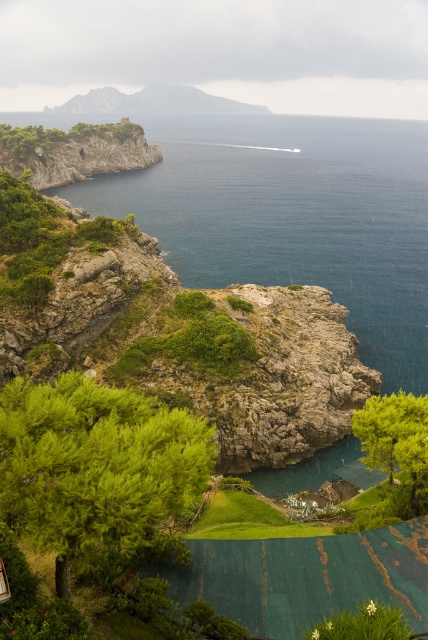
Question: Where is green leafy tree at lower left located in relation to green grassy hillside at upper center in the image?

Choices:
 (A) above
 (B) below

Answer: (B)

Question: Considering the relative positions of deep blue water at upper center and green leafy tree at lower left in the image provided, where is deep blue water at upper center located with respect to green leafy tree at lower left?

Choices:
 (A) left
 (B) right

Answer: (B)

Question: Considering the real-world distances, which object is closest to the deep blue water at upper center?

Choices:
 (A) green leafy tree at center
 (B) green grassy hillside at upper center

Answer: (A)

Question: Estimate the real-world distances between objects in this image. Which object is farther from the green grassy hillside at upper center?

Choices:
 (A) deep blue water at upper center
 (B) green leafy tree at center
 (C) green leafy tree at lower left

Answer: (C)

Question: Which of these objects is positioned closest to the green grassy hillside at upper center?

Choices:
 (A) green leafy tree at center
 (B) deep blue water at upper center

Answer: (B)

Question: In this image, where is deep blue water at upper center located relative to green leafy tree at lower left?

Choices:
 (A) above
 (B) below

Answer: (A)